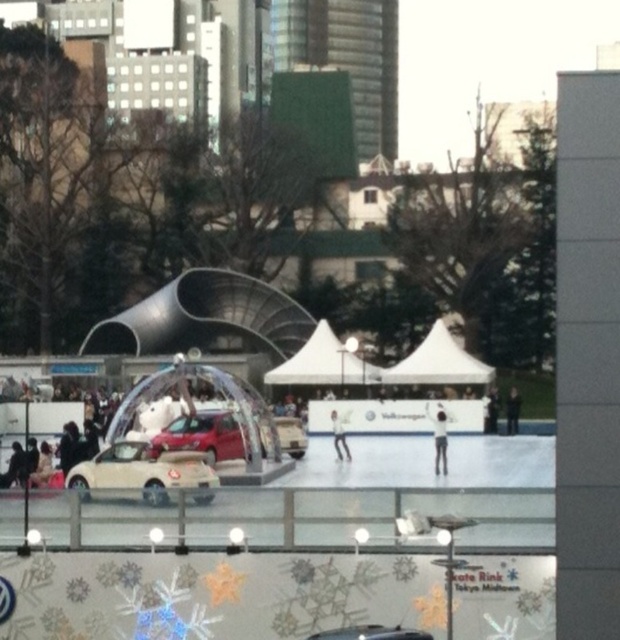
You are a photographer positioned at the edge of the ice rink. You want to take a photo that includes both the matte red car at center and the matte silver car at center. Which car should you position closer to the camera to ensure both are in focus?

The matte red car at center is already closer to the viewer than the matte silver car at center, so positioning it closer to the camera will help keep both cars in focus.

You are at the ice skating rink and notice two cars under the archway. Which car is positioned to the left when looking at the matte red car at center and the matte silver car at center?

The matte red car at center is positioned to the left of the matte silver car at center.